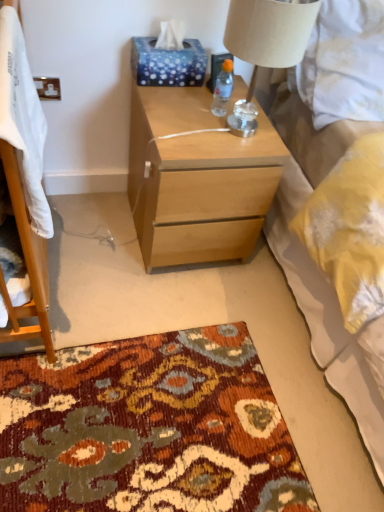
Image resolution: width=384 pixels, height=512 pixels. What do you see at coordinates (48, 87) in the screenshot?
I see `white plastic power outlet at upper left` at bounding box center [48, 87].

Measure the distance between point (310,7) and camera.

Point (310,7) and camera are 3.33 feet apart from each other.

This screenshot has height=512, width=384. What do you see at coordinates (265, 42) in the screenshot? I see `beige fabric lampshade at upper right` at bounding box center [265, 42].

Identify the location of white soft blanket at left. Image resolution: width=384 pixels, height=512 pixels. (23, 119).

Measure the distance between point (10, 64) and camera.

Point (10, 64) is 32.83 inches from camera.

I want to click on white plastic power outlet at upper left, so click(x=48, y=87).

How many degrees apart are the facing directions of white plastic power outlet at upper left and beige fabric lampshade at upper right?

The angle between the facing direction of white plastic power outlet at upper left and the facing direction of beige fabric lampshade at upper right is 0.00659 degrees.

Is white plastic power outlet at upper left positioned beyond the bounds of beige fabric lampshade at upper right?

That's correct, white plastic power outlet at upper left is outside of beige fabric lampshade at upper right.

Is white plastic power outlet at upper left thinner than beige fabric lampshade at upper right?

Yes, white plastic power outlet at upper left is thinner than beige fabric lampshade at upper right.

Are white textured bed at upper right and transparent plastic bottle at upper center beside each other?

No, white textured bed at upper right is not touching transparent plastic bottle at upper center.

Who is smaller, white textured bed at upper right or transparent plastic bottle at upper center?

transparent plastic bottle at upper center.

Between white textured bed at upper right and transparent plastic bottle at upper center, which one has more height?

white textured bed at upper right is taller.

Considering the relative sizes of white soft blanket at left and white plastic power outlet at upper left in the image provided, is white soft blanket at left wider than white plastic power outlet at upper left?

Correct, the width of white soft blanket at left exceeds that of white plastic power outlet at upper left.

Which is more to the left, white soft blanket at left or white plastic power outlet at upper left?

Positioned to the left is white plastic power outlet at upper left.

From a real-world perspective, who is located higher, white soft blanket at left or white plastic power outlet at upper left?

white soft blanket at left.

Is white soft blanket at left far away from white plastic power outlet at upper left?

white soft blanket at left is near white plastic power outlet at upper left, not far away.

Does point (12, 123) lie in front of point (241, 12)?

Yes, it is in front of point (241, 12).

Which of these two, white soft blanket at left or beige fabric lampshade at upper right, is thinner?

white soft blanket at left.

Is white soft blanket at left aimed at beige fabric lampshade at upper right?

No, white soft blanket at left is not turned towards beige fabric lampshade at upper right.

Looking at this image, based on their sizes in the image, would you say white soft blanket at left is bigger or smaller than beige fabric lampshade at upper right?

white soft blanket at left is smaller than beige fabric lampshade at upper right.

From the picture: Is blue dotted tissue at upper center facing away from transparent plastic bottle at upper center?

That's not correct — blue dotted tissue at upper center is not looking away from transparent plastic bottle at upper center.

Based on the photo, which object is thinner, blue dotted tissue at upper center or transparent plastic bottle at upper center?

With smaller width is transparent plastic bottle at upper center.

This screenshot has height=512, width=384. What are the coordinates of `tissue paper above the transparent plastic bottle at upper center (from a real-world perspective)` in the screenshot? It's located at (167, 63).

From a real-world perspective, relative to white plastic power outlet at upper left, is blue dotted tissue at upper center vertically above or below?

blue dotted tissue at upper center is situated higher than white plastic power outlet at upper left in the real world.

Which of these two, blue dotted tissue at upper center or white plastic power outlet at upper left, is wider?

With larger width is blue dotted tissue at upper center.

Locate an element on the screen. The image size is (384, 512). tissue paper located on the right of white plastic power outlet at upper left is located at coordinates (167, 63).

Is point (254, 55) closer or farther from the camera than point (182, 49)?

Point (254, 55).

How far apart are beige fabric lampshade at upper right and blue dotted tissue at upper center?

The distance of beige fabric lampshade at upper right from blue dotted tissue at upper center is 14.69 inches.

From the image's perspective, is beige fabric lampshade at upper right above blue dotted tissue at upper center?

No, from the image's perspective, beige fabric lampshade at upper right is not on top of blue dotted tissue at upper center.

Is beige fabric lampshade at upper right situated inside blue dotted tissue at upper center or outside?

The correct answer is: outside.

The height and width of the screenshot is (512, 384). In the image, there is a beige fabric lampshade at upper right. Identify the location of power outlet above it (from the image's perspective). (48, 87).

At what (x,y) coordinates should I click in order to perform the action: click on bottle that appears above the white textured bed at upper right (from a real-world perspective). Please return your answer as a coordinate pair (x, y). This screenshot has height=512, width=384. Looking at the image, I should click on (223, 89).

Which object lies nearer to the anchor point white soft blanket at left, light wood/finish nightstand at center or white textured bed at upper right?

Among the two, light wood/finish nightstand at center is located nearer to white soft blanket at left.

Based on their spatial positions, is transparent plastic bottle at upper center or white textured bed at upper right closer to beige fabric lampshade at upper right?

Among the two, transparent plastic bottle at upper center is located nearer to beige fabric lampshade at upper right.

When comparing their distances from white soft blanket at left, does blue dotted tissue at upper center or white plastic power outlet at upper left seem closer?

blue dotted tissue at upper center is closer to white soft blanket at left.

Based on their spatial positions, is transparent plastic bottle at upper center or white soft blanket at left further from light wood/finish nightstand at center?

white soft blanket at left lies further to light wood/finish nightstand at center than the other object.

Considering their positions, is white plastic power outlet at upper left positioned further to blue dotted tissue at upper center than white textured bed at upper right?

white textured bed at upper right is positioned further to the anchor blue dotted tissue at upper center.

Considering their positions, is light wood/finish nightstand at center positioned closer to white soft blanket at left than white plastic power outlet at upper left?

light wood/finish nightstand at center is positioned closer to the anchor white soft blanket at left.

Which object lies nearer to the anchor point transparent plastic bottle at upper center, white plastic power outlet at upper left or white soft blanket at left?

Among the two, white plastic power outlet at upper left is located nearer to transparent plastic bottle at upper center.

Which object lies nearer to the anchor point blue dotted tissue at upper center, transparent plastic bottle at upper center or light wood/finish nightstand at center?

Based on the image, transparent plastic bottle at upper center appears to be nearer to blue dotted tissue at upper center.

Where is `tissue paper between white soft blanket at left and white plastic power outlet at upper left in the front-back direction`? Image resolution: width=384 pixels, height=512 pixels. tissue paper between white soft blanket at left and white plastic power outlet at upper left in the front-back direction is located at coordinates (167, 63).

Where is `bottle between white soft blanket at left and blue dotted tissue at upper center from front to back`? bottle between white soft blanket at left and blue dotted tissue at upper center from front to back is located at coordinates (223, 89).

You are a GUI agent. You are given a task and a screenshot of the screen. Output one action in this format:
    pyautogui.click(x=<x>, y=<y>)
    Task: Click on the lamp between white plastic power outlet at upper left and white textured bed at upper right
    
    Given the screenshot: What is the action you would take?
    point(265,42)

Where is `tissue paper situated between white soft blanket at left and white textured bed at upper right from left to right`? This screenshot has width=384, height=512. tissue paper situated between white soft blanket at left and white textured bed at upper right from left to right is located at coordinates (167, 63).